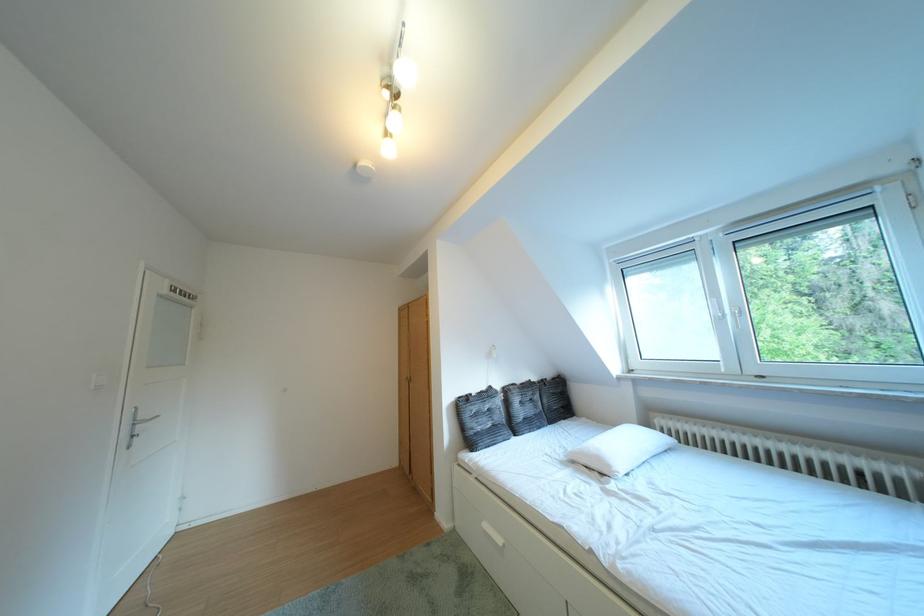
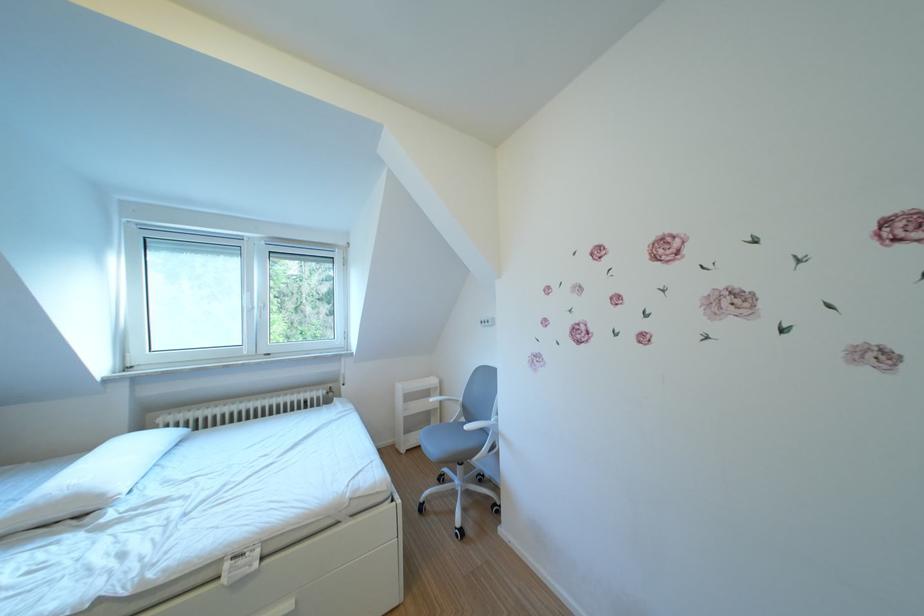
In the second image, find the point that corresponds to the point at 623,471 in the first image.

(115, 501)